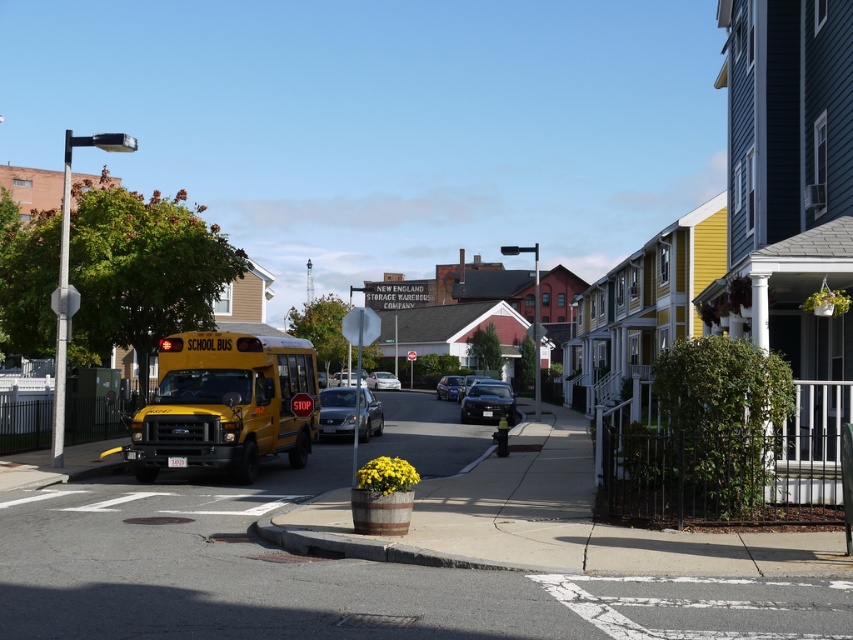
You are a delivery driver needing to park your 2.5 meters wide truck between the satin silver sedan at center and the white glossy sedan at center on the suburban street. Can you fit your truck in the space between them?

The satin silver sedan at center has a lesser width compared to white glossy sedan at center, so the space between them might be sufficient for your 2.5 meters wide truck. However, without knowing the exact distance between the two sedans, it is uncertain if the truck will fit. Consider checking the available space before attempting to park.